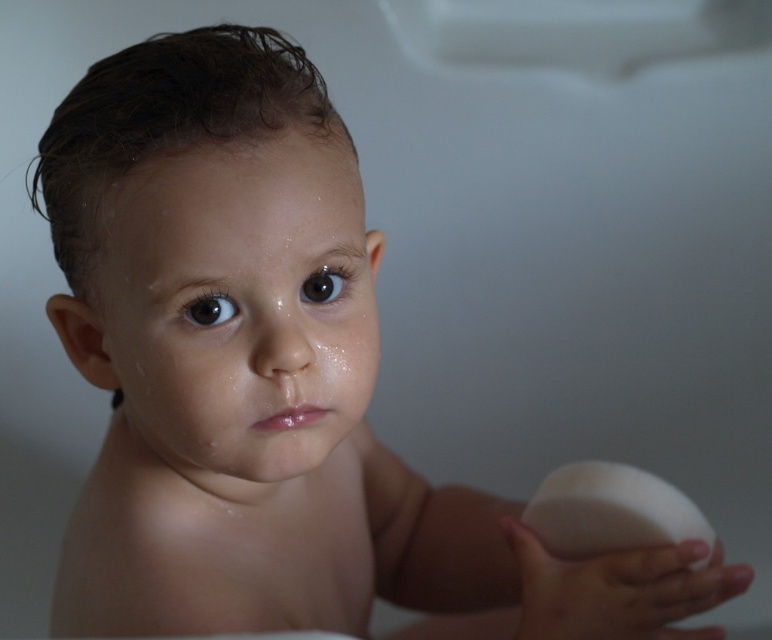
In the scene shown: Can you confirm if white matte ball at lower right is shorter than white matte soap at lower right?

Incorrect, white matte ball at lower right's height does not fall short of white matte soap at lower right's.

Who is more forward, [603,566] or [654,540]?

Point [603,566] is in front.

Between point (564, 588) and point (672, 499), which one is positioned behind?

The point (672, 499) is behind.

Locate an element on the screen. white matte ball at lower right is located at coordinates pos(618,589).